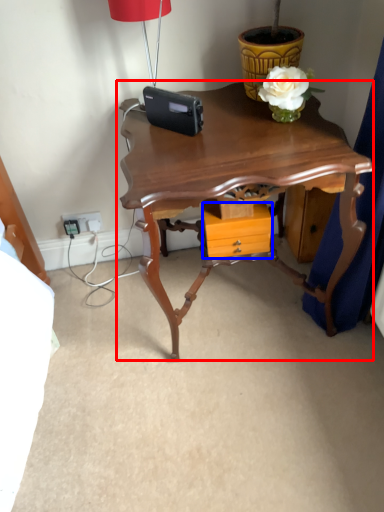
Question: Which point is further to the camera, table (highlighted by a red box) or drawer (highlighted by a blue box)?

Choices:
 (A) table
 (B) drawer

Answer: (B)